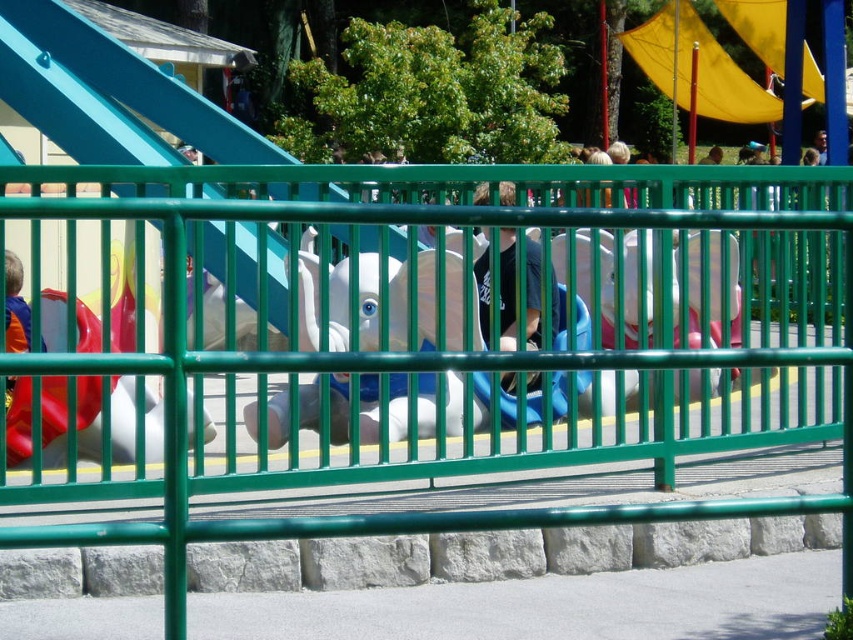
Question: Among these objects, which one is nearest to the camera?

Choices:
 (A) yellow fabric slide at upper center
 (B) white plastic elephant at center
 (C) green metal fence at center

Answer: (C)

Question: Which point is farther from the camera taking this photo?

Choices:
 (A) (312, 264)
 (B) (747, 80)

Answer: (B)

Question: Can you confirm if green metal fence at center is wider than white plastic elephant at center?

Choices:
 (A) no
 (B) yes

Answer: (B)

Question: Is green metal fence at center further to camera compared to white plastic elephant at center?

Choices:
 (A) yes
 (B) no

Answer: (B)

Question: Which point appears farthest from the camera in this image?

Choices:
 (A) (368, 344)
 (B) (753, 122)
 (C) (784, 508)

Answer: (B)

Question: Is green metal fence at center further to the viewer compared to yellow fabric slide at upper center?

Choices:
 (A) yes
 (B) no

Answer: (B)